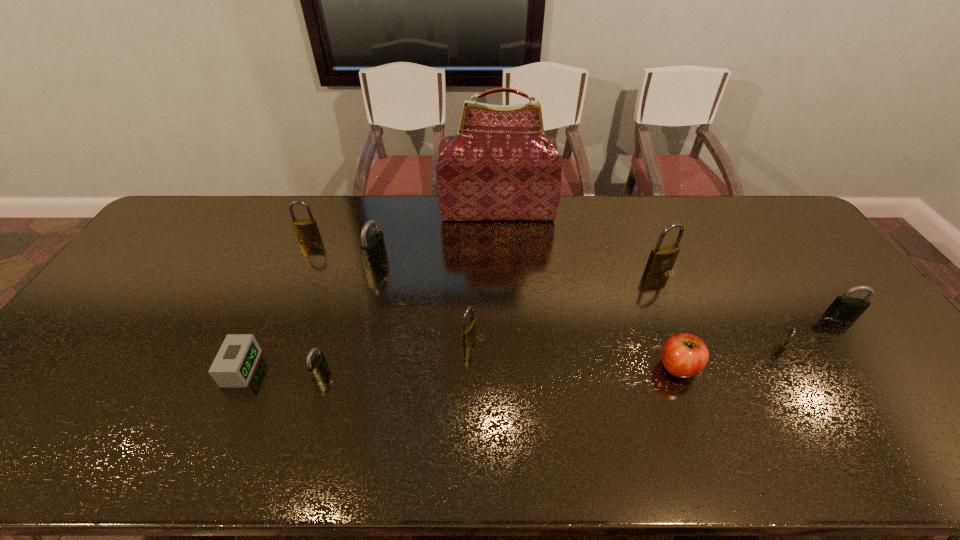
Where is `handbag`? handbag is located at coordinates (500, 166).

Locate an element on the screen. The image size is (960, 540). the tallest object is located at coordinates (500, 166).

Image resolution: width=960 pixels, height=540 pixels. I want to click on the biggest brass padlock, so click(x=661, y=259).

In order to click on the second brass padlock from right to left in this screenshot , I will do `click(661, 259)`.

Image resolution: width=960 pixels, height=540 pixels. I want to click on the fifth padlock from right to left, so click(373, 250).

Identify the location of the second black padlock from left to right. (373, 250).

Locate an element on the screen. This screenshot has width=960, height=540. the farthest brass padlock is located at coordinates (306, 229).

Locate an element on the screen. The width and height of the screenshot is (960, 540). the third smallest brass padlock is located at coordinates (306, 229).

In order to click on the rightmost object in this screenshot , I will do `click(844, 307)`.

Where is `the second nearest black padlock`? The width and height of the screenshot is (960, 540). the second nearest black padlock is located at coordinates (844, 307).